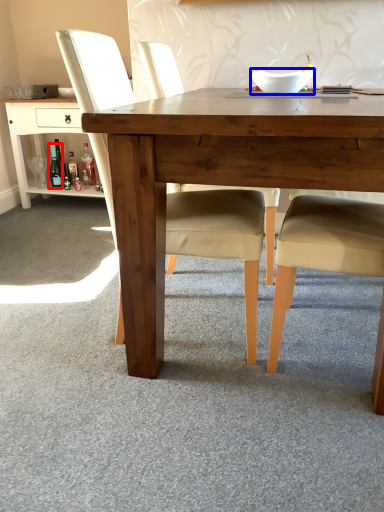
Question: Which point is further to the camera, bottle (highlighted by a red box) or bowl (highlighted by a blue box)?

Choices:
 (A) bottle
 (B) bowl

Answer: (A)